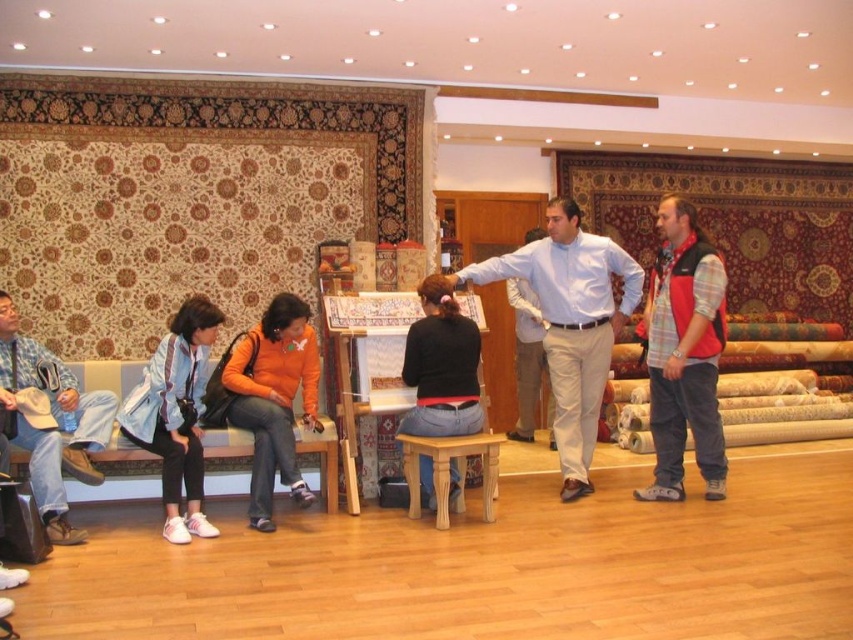
You are a customer in the carpet shop and want to know if the light blue shirt at center is wider than the black matte shirt at center. Can you determine this based on the scene?

The light blue shirt at center might be wider than black matte shirt at center according to the scene description.

You are a customer in the carpet shop. You see the denim jeans at left and the white shirt at center. Which one is shorter in height?

The denim jeans at left is not as tall as the white shirt at center, so the denim jeans at left is shorter in height.